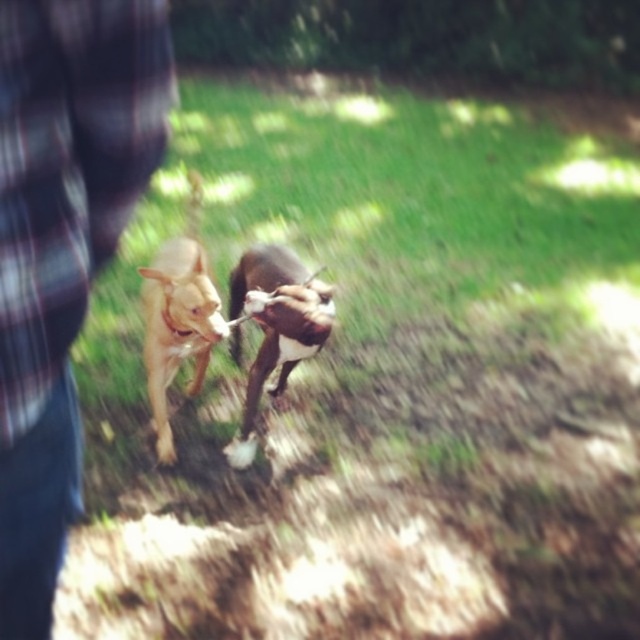
You are a photographer trying to capture a photo of the plaid fabric shirt at left and the brown fur dog at center. If you want to ensure both subjects are in the frame, which one should you adjust your camera focus on first based on their sizes?

The plaid fabric shirt at left has a lesser width compared to the brown fur dog at center, so you should focus on the brown fur dog at center first since it is larger and requires more attention in the frame.